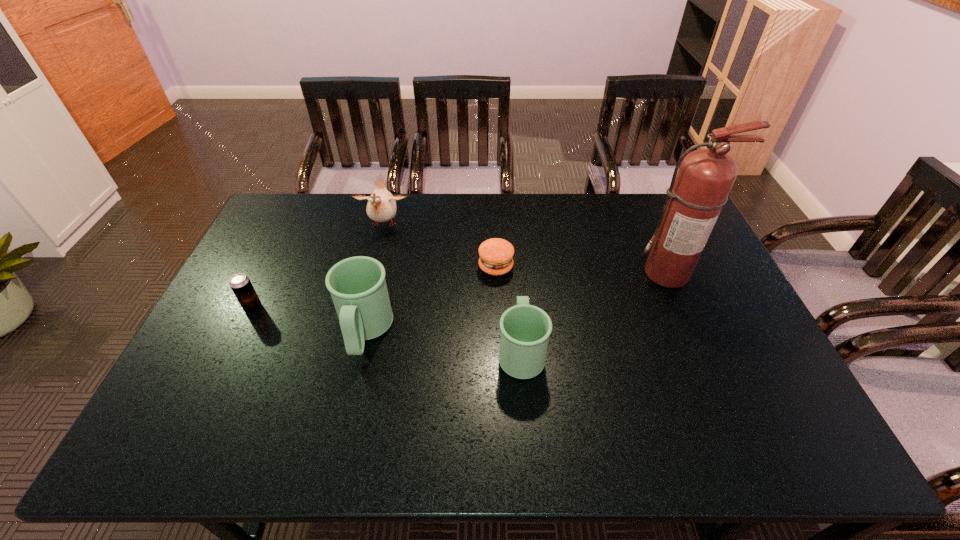
The image size is (960, 540). In order to click on empty space that is in between the rightmost object and the shortest object in this screenshot , I will do `click(582, 270)`.

Image resolution: width=960 pixels, height=540 pixels. I want to click on free space between the right mug and the left mug, so click(x=444, y=341).

This screenshot has width=960, height=540. I want to click on object that is the fourth closest to the leftmost object, so click(525, 329).

I want to click on the fifth closest object relative to the shorter mug, so click(240, 284).